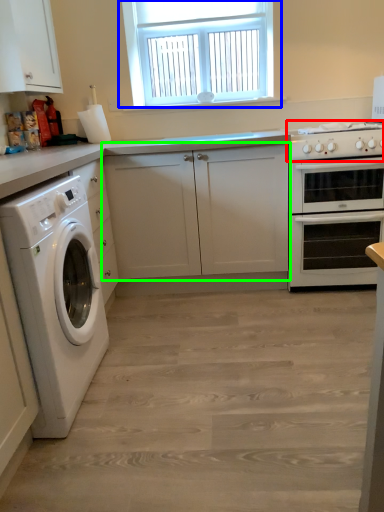
Question: Based on their relative distances, which object is farther from gas stove (highlighted by a red box)? Choose from window (highlighted by a blue box) and cabinetry (highlighted by a green box).

Choices:
 (A) window
 (B) cabinetry

Answer: (A)